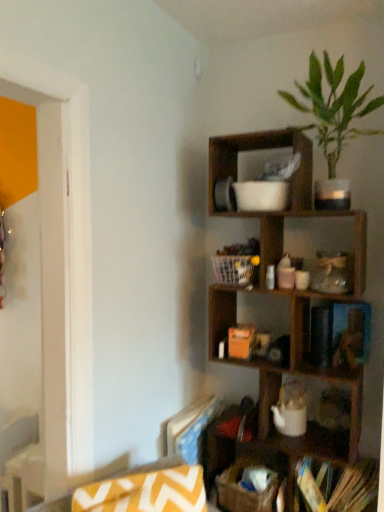
Question: Does green leafy plant at upper right come behind brown woven basket at lower center?

Choices:
 (A) no
 (B) yes

Answer: (A)

Question: Considering the relative positions of green leafy plant at upper right and brown woven basket at lower center in the image provided, is green leafy plant at upper right to the left of brown woven basket at lower center from the viewer's perspective?

Choices:
 (A) yes
 (B) no

Answer: (B)

Question: Considering the relative positions of green leafy plant at upper right and brown woven basket at lower center in the image provided, is green leafy plant at upper right to the right of brown woven basket at lower center from the viewer's perspective?

Choices:
 (A) yes
 (B) no

Answer: (A)

Question: Is green leafy plant at upper right wider than brown woven basket at lower center?

Choices:
 (A) no
 (B) yes

Answer: (B)

Question: From a real-world perspective, does green leafy plant at upper right sit lower than brown woven basket at lower center?

Choices:
 (A) no
 (B) yes

Answer: (A)

Question: Considering the relative sizes of green leafy plant at upper right and brown woven basket at lower center in the image provided, is green leafy plant at upper right smaller than brown woven basket at lower center?

Choices:
 (A) yes
 (B) no

Answer: (B)

Question: Can you confirm if brown woven basket at lower center is wider than yellow zigzag fabric swivel chair at lower left?

Choices:
 (A) yes
 (B) no

Answer: (A)

Question: Can you confirm if brown woven basket at lower center is positioned to the right of yellow zigzag fabric swivel chair at lower left?

Choices:
 (A) no
 (B) yes

Answer: (B)

Question: Does brown woven basket at lower center have a smaller size compared to yellow zigzag fabric swivel chair at lower left?

Choices:
 (A) no
 (B) yes

Answer: (B)

Question: Would you consider brown woven basket at lower center to be distant from yellow zigzag fabric swivel chair at lower left?

Choices:
 (A) no
 (B) yes

Answer: (A)

Question: Does brown woven basket at lower center have a lesser width compared to yellow zigzag fabric swivel chair at lower left?

Choices:
 (A) yes
 (B) no

Answer: (B)

Question: Does brown woven basket at lower center have a greater height compared to yellow zigzag fabric swivel chair at lower left?

Choices:
 (A) yes
 (B) no

Answer: (B)

Question: Is white plastic basket at center further to camera compared to wooden shelf at upper right?

Choices:
 (A) no
 (B) yes

Answer: (B)